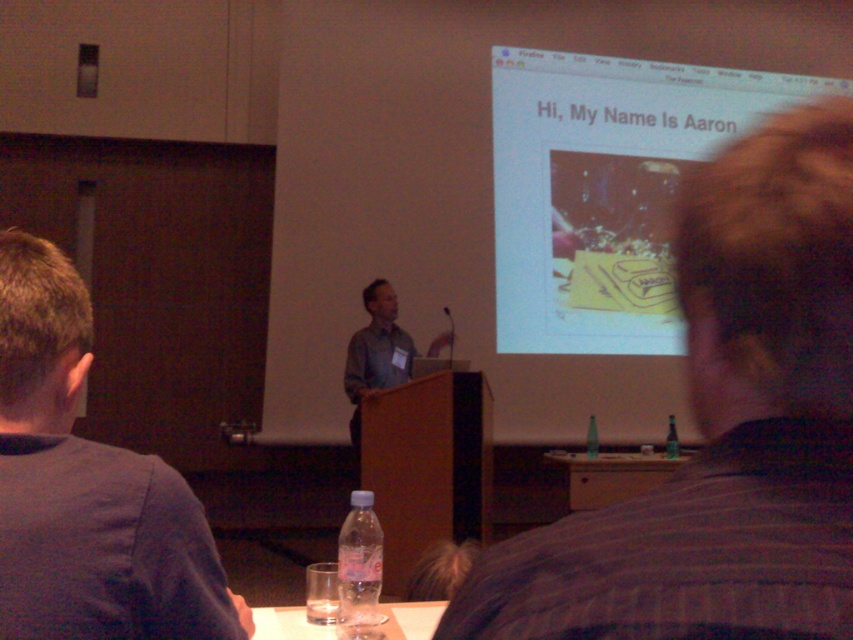
Question: Observing the image, what is the correct spatial positioning of wooden at center in reference to green glass bottle at right?

Choices:
 (A) below
 (B) above

Answer: (A)

Question: Estimate the real-world distances between objects in this image. Which object is closer to the green glass bottle at right?

Choices:
 (A) wooden at center
 (B) dark blue shirt at left

Answer: (A)

Question: Is gray shirt at center to the left of green glass bottle at right from the viewer's perspective?

Choices:
 (A) no
 (B) yes

Answer: (B)

Question: Which object is positioned closest to the striped shirt at upper right?

Choices:
 (A) green glass bottle at right
 (B) wooden at center

Answer: (B)

Question: Which point appears closest to the camera in this image?

Choices:
 (A) (592, 420)
 (B) (128, 490)

Answer: (B)

Question: Is striped shirt at upper right behind green glass bottle at center?

Choices:
 (A) no
 (B) yes

Answer: (A)